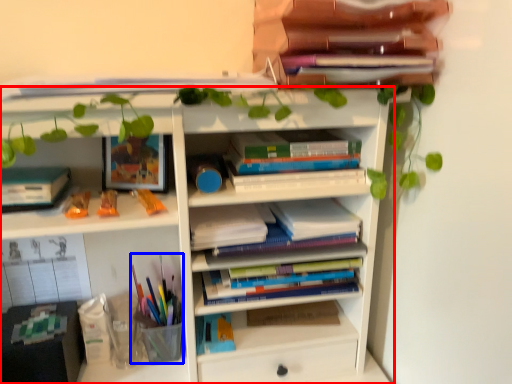
Question: Which object is further to the camera taking this photo, shelf (highlighted by a red box) or stationery (highlighted by a blue box)?

Choices:
 (A) shelf
 (B) stationery

Answer: (B)